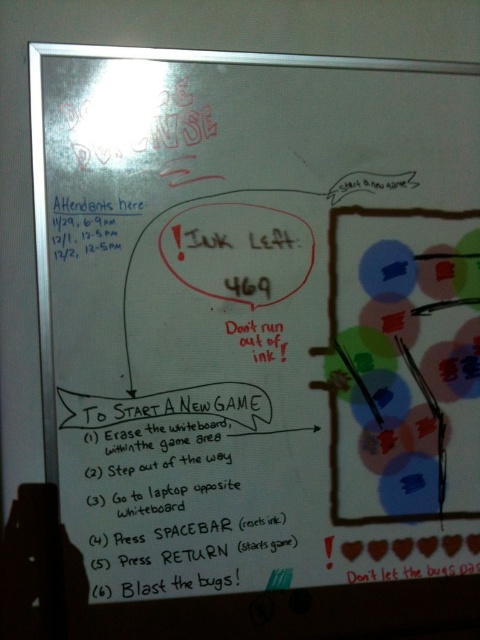
Is point (106, 424) closer to camera compared to point (80, 243)?

No.

Between point (76, 525) and point (92, 228), which one is positioned in front?

Point (92, 228) is in front.

I want to click on black handwritten text at center, so click(188, 490).